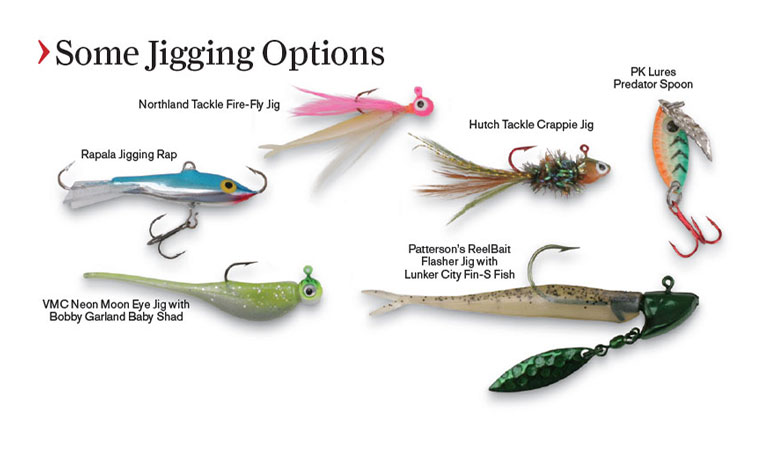
At what (x,y) coordinates should I click in order to perform the action: click on red hooks. Please return your answer as a coordinate pair (x, y). Looking at the image, I should click on (697, 232), (511, 154).